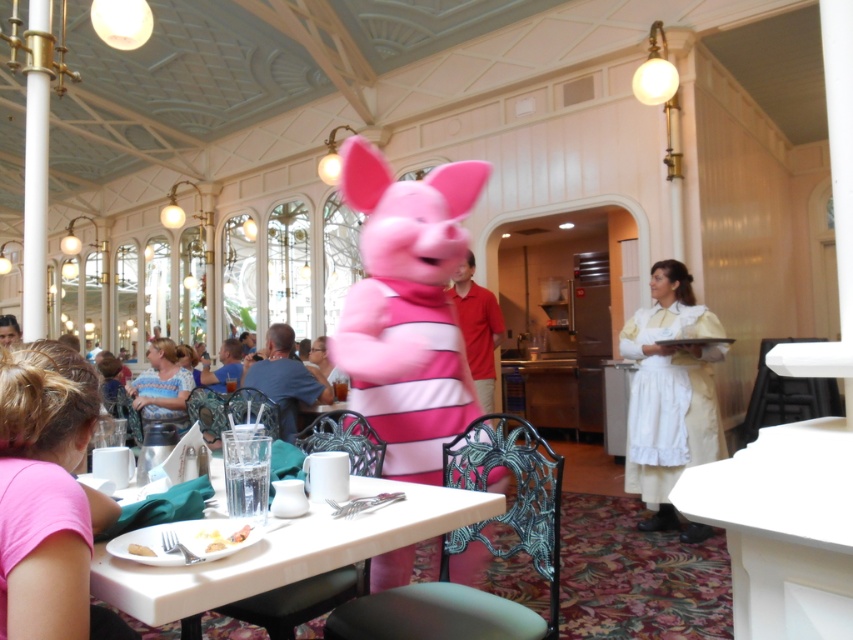
Locate an element on the screen. blue striped shirt at lower left is located at coordinates (161, 387).

Based on the photo, does blue striped shirt at lower left appear under yellow matte bread at table center?

Indeed, blue striped shirt at lower left is positioned under yellow matte bread at table center.

Between point (181, 428) and point (207, 529), which one is positioned behind?

Point (181, 428)

Where is `blue striped shirt at lower left`? blue striped shirt at lower left is located at coordinates (161, 387).

Is pink fabric shirt at lower left wider than white matte plate at lower left?

Yes, pink fabric shirt at lower left is wider than white matte plate at lower left.

Can you confirm if pink fabric shirt at lower left is positioned to the left of white matte plate at lower left?

Correct, you'll find pink fabric shirt at lower left to the left of white matte plate at lower left.

Identify the location of pink fabric shirt at lower left. This screenshot has height=640, width=853. (45, 496).

Between point (132, 406) and point (144, 554), which one is positioned behind?

Point (132, 406)

Is blue striped shirt at lower left positioned in front of white matte plate at lower left?

No.

This screenshot has width=853, height=640. What do you see at coordinates (161, 387) in the screenshot? I see `blue striped shirt at lower left` at bounding box center [161, 387].

This screenshot has width=853, height=640. Find the location of `blue striped shirt at lower left`. blue striped shirt at lower left is located at coordinates (161, 387).